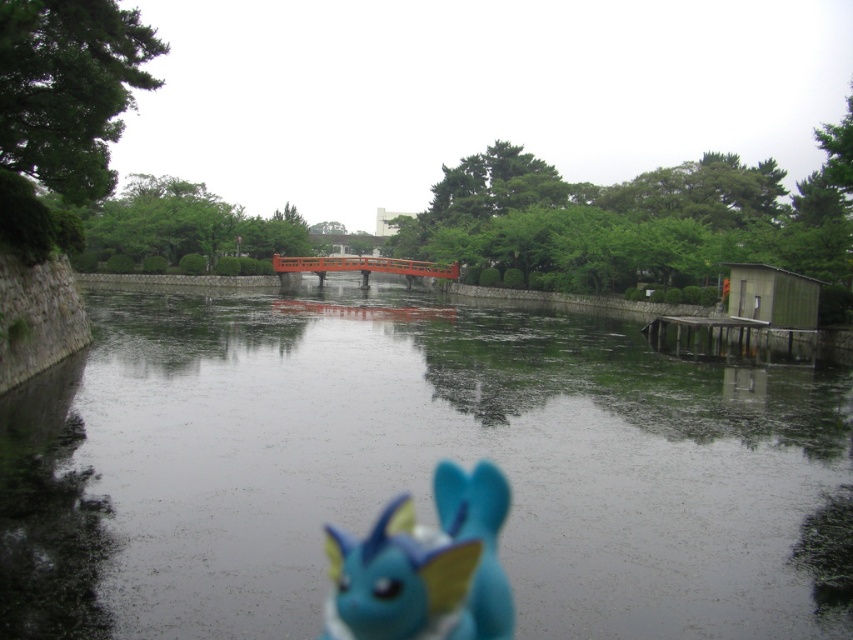
The image size is (853, 640). I want to click on glossy concrete river at center, so click(415, 468).

Is glossy concrete river at center wider than blue matte toy at center?

Correct, the width of glossy concrete river at center exceeds that of blue matte toy at center.

Which is in front, point (363, 340) or point (432, 483)?

Point (432, 483) is more forward.

I want to click on glossy concrete river at center, so click(x=415, y=468).